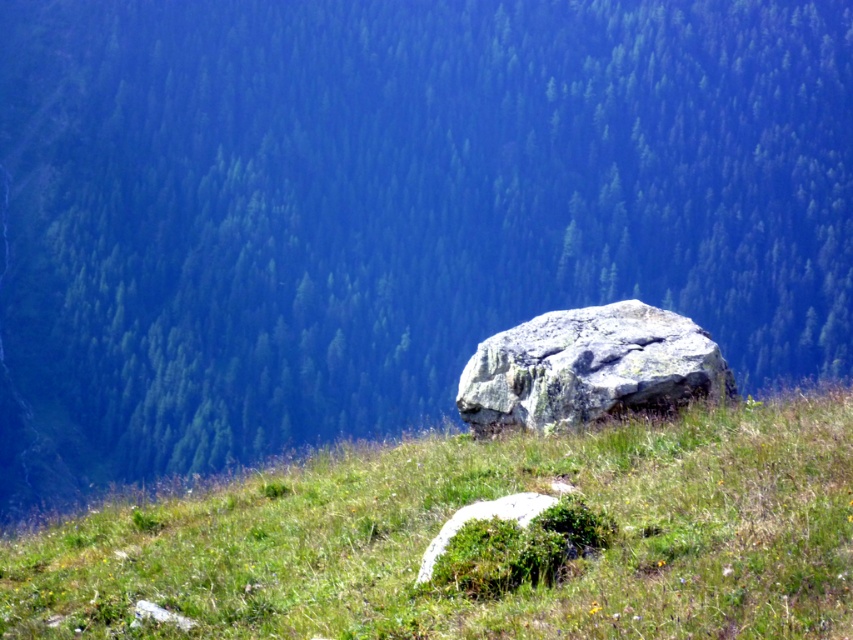
Question: Where is green grassy at center located in relation to green mossy rock at center in the image?

Choices:
 (A) below
 (B) above

Answer: (B)

Question: Which is farther from the gray rough rock at center?

Choices:
 (A) green mossy rock at center
 (B) green grassy at center

Answer: (A)

Question: Which object is positioned farthest from the gray rough rock at center?

Choices:
 (A) green mossy rock at center
 (B) green grassy at center

Answer: (A)

Question: Does gray rough rock at center have a greater width compared to green mossy rock at center?

Choices:
 (A) yes
 (B) no

Answer: (A)

Question: Observing the image, what is the correct spatial positioning of gray rough rock at center in reference to green mossy rock at center?

Choices:
 (A) below
 (B) above

Answer: (B)

Question: Which of these objects is positioned closest to the green mossy rock at center?

Choices:
 (A) gray rough rock at center
 (B) green grassy at center

Answer: (B)